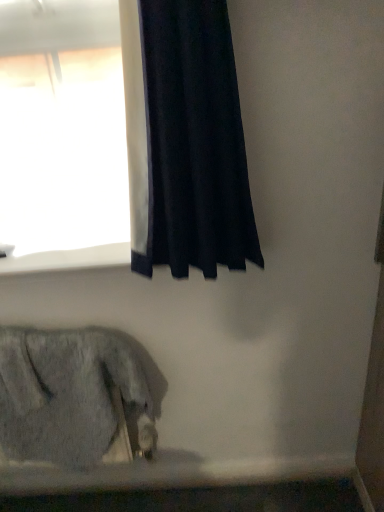
In order to click on fuzzy gray cat at lower left in this screenshot , I will do `click(69, 396)`.

This screenshot has width=384, height=512. I want to click on fuzzy gray cat at lower left, so click(69, 396).

Can you confirm if fuzzy gray cat at lower left is positioned to the right of black velvet curtain at upper left?

No, fuzzy gray cat at lower left is not to the right of black velvet curtain at upper left.

Looking at this image, considering the sizes of objects fuzzy gray cat at lower left and black velvet curtain at upper left in the image provided, who is taller, fuzzy gray cat at lower left or black velvet curtain at upper left?

black velvet curtain at upper left is taller.

Measure the distance between fuzzy gray cat at lower left and black velvet curtain at upper left.

fuzzy gray cat at lower left is 21.17 inches from black velvet curtain at upper left.

From the image's perspective, is white smooth window sill at upper left located above fuzzy gray cat at lower left?

Yes, from the image's perspective, white smooth window sill at upper left is over fuzzy gray cat at lower left.

Considering the positions of point (29, 256) and point (51, 443), is point (29, 256) closer or farther from the camera than point (51, 443)?

Clearly, point (29, 256) is closer to the camera than point (51, 443).

Is fuzzy gray cat at lower left at the back of white smooth window sill at upper left?

No.

Considering the relative positions of white smooth window sill at upper left and fuzzy gray cat at lower left in the image provided, is white smooth window sill at upper left to the right of fuzzy gray cat at lower left from the viewer's perspective?

Yes.

Is white smooth window sill at upper left not within black velvet curtain at upper left?

Yes, white smooth window sill at upper left is not within black velvet curtain at upper left.

From the picture: Which is more to the left, white smooth window sill at upper left or black velvet curtain at upper left?

From the viewer's perspective, white smooth window sill at upper left appears more on the left side.

Does point (44, 267) come behind point (161, 177)?

Yes, point (44, 267) is farther from viewer.

You are a GUI agent. You are given a task and a screenshot of the screen. Output one action in this format:
    pyautogui.click(x=<x>, y=<y>)
    Task: Click on the window sill lying on the left of black velvet curtain at upper left
    
    Given the screenshot: What is the action you would take?
    pyautogui.click(x=68, y=259)

From the image's perspective, which is below, black velvet curtain at upper left or white smooth window sill at upper left?

white smooth window sill at upper left is shown below in the image.

Identify the location of window sill behind the black velvet curtain at upper left. The image size is (384, 512). (68, 259).

From a real-world perspective, is black velvet curtain at upper left located beneath white smooth window sill at upper left?

Actually, black velvet curtain at upper left is physically above white smooth window sill at upper left in the real world.

Is black velvet curtain at upper left smaller than white smooth window sill at upper left?

No, black velvet curtain at upper left is not smaller than white smooth window sill at upper left.

Which of these two, black velvet curtain at upper left or fuzzy gray cat at lower left, is smaller?

Smaller between the two is black velvet curtain at upper left.

Does black velvet curtain at upper left turn towards fuzzy gray cat at lower left?

No, black velvet curtain at upper left is not aimed at fuzzy gray cat at lower left.

Does point (211, 208) lie behind point (111, 429)?

No, (211, 208) is closer to viewer.

From the image's perspective, does black velvet curtain at upper left appear higher than fuzzy gray cat at lower left?

Yes, from the image's perspective, black velvet curtain at upper left is above fuzzy gray cat at lower left.

Does fuzzy gray cat at lower left have a greater height compared to white smooth window sill at upper left?

Indeed, fuzzy gray cat at lower left has a greater height compared to white smooth window sill at upper left.

How many degrees apart are the facing directions of fuzzy gray cat at lower left and white smooth window sill at upper left?

There is a 0.0575-degree angle between the facing directions of fuzzy gray cat at lower left and white smooth window sill at upper left.

Is fuzzy gray cat at lower left completely or partially outside of white smooth window sill at upper left?

Yes.

Which is in front, fuzzy gray cat at lower left or white smooth window sill at upper left?

fuzzy gray cat at lower left is more forward.

This screenshot has height=512, width=384. What are the coordinates of `curtain to the right of fuzzy gray cat at lower left` in the screenshot? It's located at (193, 143).

Where is `window sill above the fuzzy gray cat at lower left (from a real-world perspective)`? window sill above the fuzzy gray cat at lower left (from a real-world perspective) is located at coordinates (68, 259).

Considering their positions, is black velvet curtain at upper left positioned closer to white smooth window sill at upper left than fuzzy gray cat at lower left?

black velvet curtain at upper left is positioned closer to the anchor white smooth window sill at upper left.

Estimate the real-world distances between objects in this image. Which object is closer to fuzzy gray cat at lower left, white smooth window sill at upper left or black velvet curtain at upper left?

white smooth window sill at upper left lies closer to fuzzy gray cat at lower left than the other object.

From the image, which object appears to be nearer to black velvet curtain at upper left, white smooth window sill at upper left or fuzzy gray cat at lower left?

white smooth window sill at upper left.

Based on their spatial positions, is fuzzy gray cat at lower left or black velvet curtain at upper left further from white smooth window sill at upper left?

fuzzy gray cat at lower left is positioned further to the anchor white smooth window sill at upper left.

Considering their positions, is black velvet curtain at upper left positioned closer to fuzzy gray cat at lower left than white smooth window sill at upper left?

white smooth window sill at upper left.

Considering their positions, is fuzzy gray cat at lower left positioned further to black velvet curtain at upper left than white smooth window sill at upper left?

fuzzy gray cat at lower left is positioned further to the anchor black velvet curtain at upper left.

This screenshot has width=384, height=512. Identify the location of window sill between black velvet curtain at upper left and fuzzy gray cat at lower left vertically. (68, 259).